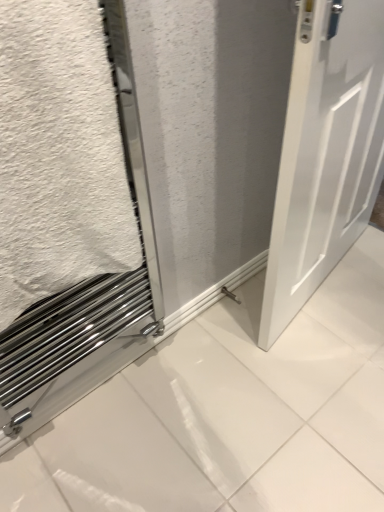
Locate an element on the screen. Image resolution: width=384 pixels, height=512 pixels. vacant space underneath white matte towel at lower left (from a real-world perspective) is located at coordinates (125, 409).